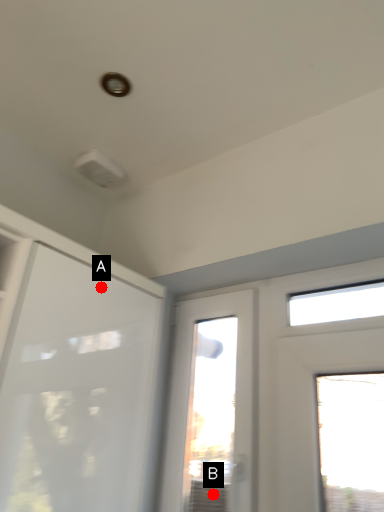
Question: Two points are circled on the image, labeled by A and B beside each circle. Which point is farther from the camera taking this photo?

Choices:
 (A) A is further
 (B) B is further

Answer: (B)